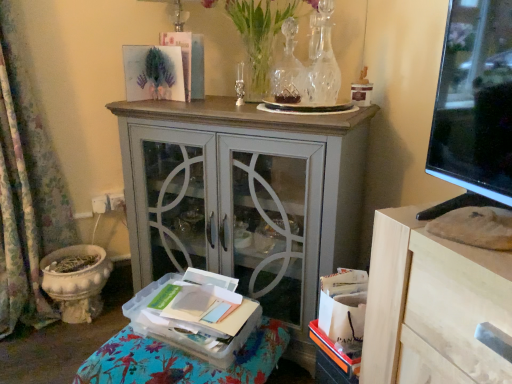
Question: Considering the relative sizes of floral fabric curtain at left and clear glass vase at upper center in the image provided, is floral fabric curtain at left shorter than clear glass vase at upper center?

Choices:
 (A) yes
 (B) no

Answer: (B)

Question: Is floral fabric curtain at left oriented towards clear glass vase at upper center?

Choices:
 (A) yes
 (B) no

Answer: (B)

Question: Can you confirm if floral fabric curtain at left is smaller than clear glass vase at upper center?

Choices:
 (A) yes
 (B) no

Answer: (B)

Question: From the image's perspective, is floral fabric curtain at left on clear glass vase at upper center?

Choices:
 (A) yes
 (B) no

Answer: (B)

Question: Would you say floral fabric curtain at left is outside clear glass vase at upper center?

Choices:
 (A) yes
 (B) no

Answer: (A)

Question: Is floral fabric curtain at left closer to the viewer compared to clear glass vase at upper center?

Choices:
 (A) no
 (B) yes

Answer: (A)

Question: From the image's perspective, is clear glass vase at upper center below clear glass vase at upper center, which ranks as the 2th vase in right-to-left order?

Choices:
 (A) no
 (B) yes

Answer: (A)

Question: Is clear glass vase at upper center closer to the viewer compared to clear glass vase at upper center, which ranks as the 2th vase in right-to-left order?

Choices:
 (A) no
 (B) yes

Answer: (B)

Question: Would you consider clear glass vase at upper center to be distant from clear glass vase at upper center, acting as the 1th vase starting from the left?

Choices:
 (A) no
 (B) yes

Answer: (A)

Question: Is clear glass vase at upper center taller than clear glass vase at upper center, acting as the 1th vase starting from the left?

Choices:
 (A) yes
 (B) no

Answer: (A)

Question: Is clear glass vase at upper center shorter than clear glass vase at upper center, which ranks as the 2th vase in right-to-left order?

Choices:
 (A) yes
 (B) no

Answer: (B)

Question: Is clear glass vase at upper center oriented towards clear glass vase at upper center, which ranks as the 2th vase in right-to-left order?

Choices:
 (A) yes
 (B) no

Answer: (A)

Question: Does floral fabric curtain at left have a larger size compared to gray painted cabinet at center?

Choices:
 (A) no
 (B) yes

Answer: (A)